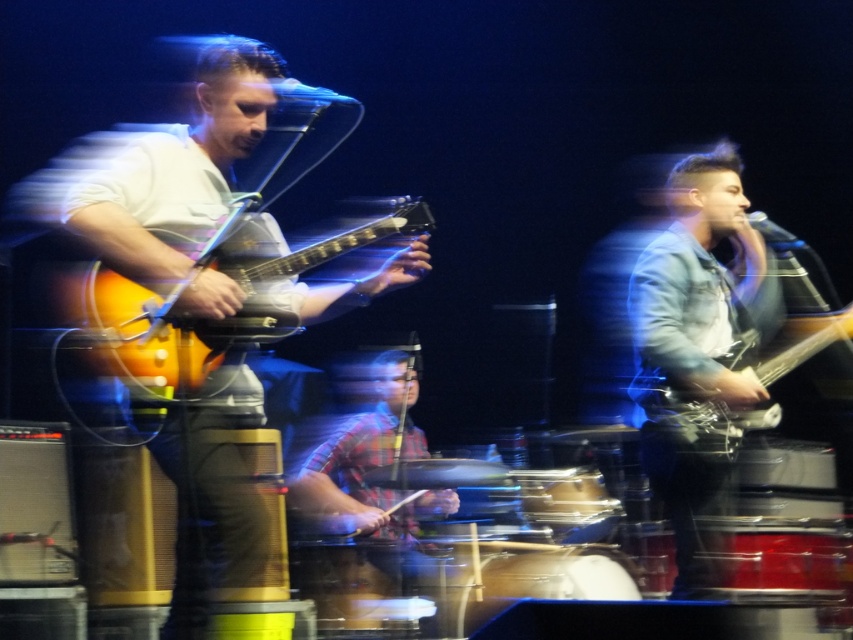
Between matte orange electric guitar at left and smooth brown drum at center, which one is positioned lower?

smooth brown drum at center is lower down.

Can you confirm if matte orange electric guitar at left is smaller than smooth brown drum at center?

Incorrect, matte orange electric guitar at left is not smaller in size than smooth brown drum at center.

Image resolution: width=853 pixels, height=640 pixels. I want to click on matte orange electric guitar at left, so click(248, 285).

Can you confirm if matte black guitar at right is bigger than smooth brown drum at center?

Yes.

Who is more forward, (x=839, y=332) or (x=473, y=586)?

Point (x=839, y=332) is in front.

Where is `matte black guitar at right`? The image size is (853, 640). matte black guitar at right is located at coordinates (699, 417).

Which of these two, matte orange guitar at left or matte orange electric guitar at left, stands taller?

matte orange guitar at left

Which of these two, matte orange guitar at left or matte orange electric guitar at left, stands shorter?

With less height is matte orange electric guitar at left.

What are the coordinates of `matte orange guitar at left` in the screenshot? It's located at (204, 304).